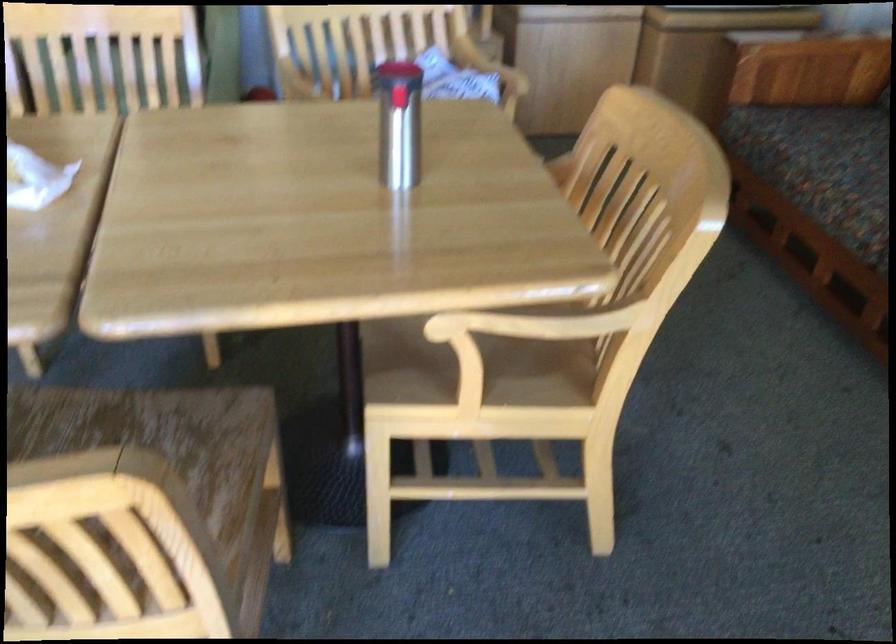
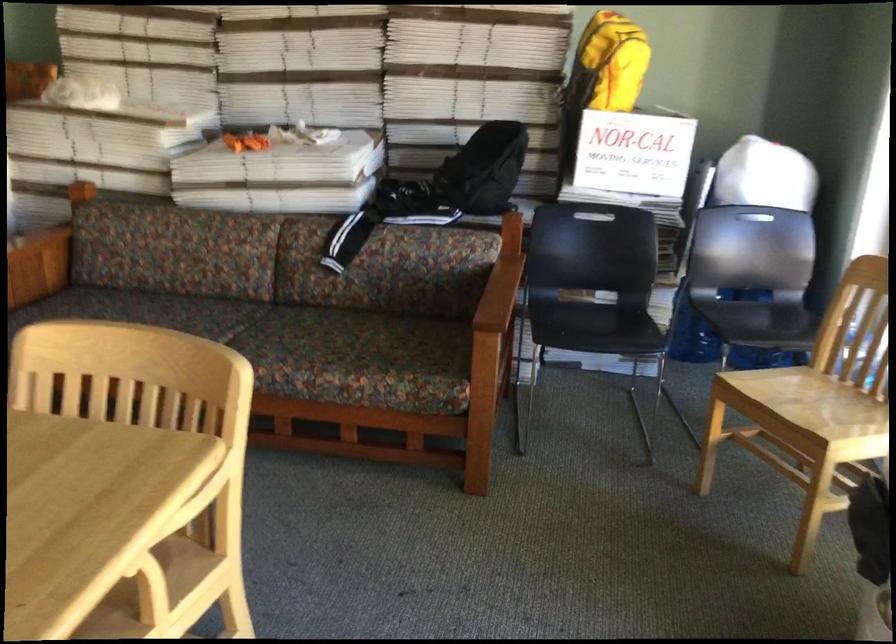
Question: How did the camera likely rotate?

Choices:
 (A) Left
 (B) Right
 (C) Up
 (D) Down

Answer: (B)